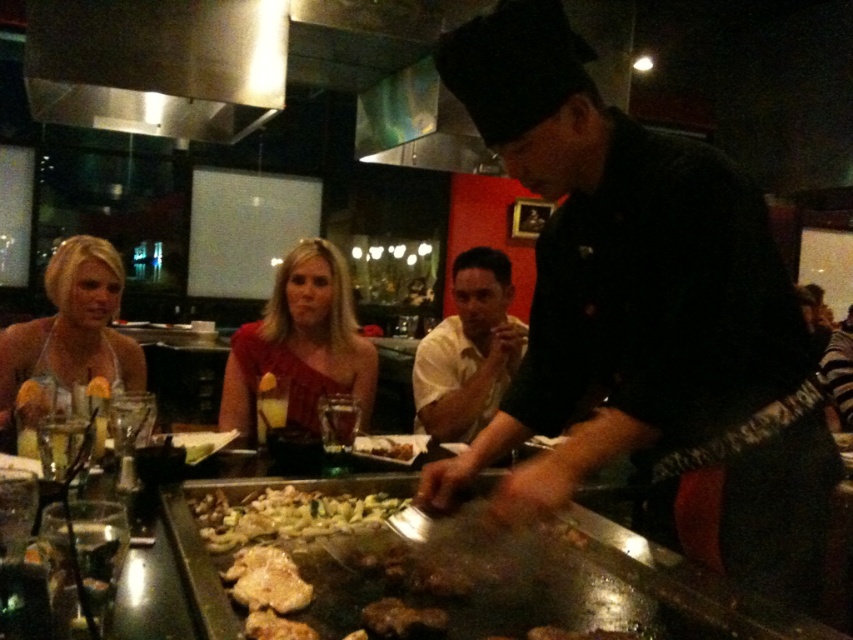
You are a chef holding a spatula that is 4 inches long. You want to flip the golden brown meat at center using the shiny silver pan at center. Can you reach the meat with your spatula without moving the pan?

The distance between the golden brown meat at center and the shiny silver pan at center is 3.79 inches. Since the spatula is 4 inches long, it is long enough to reach the meat without needing to move the pan.

You are a photographer standing at the entrance of the teppanyaki restaurant. You want to take a photo of the chef and the two people wearing the matte red dress at center and the yellow matte shirt at center. Which of the two people is positioned closer to the camera?

The matte red dress at center is closer to the viewer than the yellow matte shirt at center, so the person wearing the matte red dress at center is closer to the camera.

You are a customer sitting at the table in the teppanyaki restaurant. You notice two points on the griddle where the chef is cooking. The first point is at coordinates point (323, 372), and the second is at point (502, 282). Which point is closer to you?

Point (323, 372) is closer to the viewer than point (502, 282).